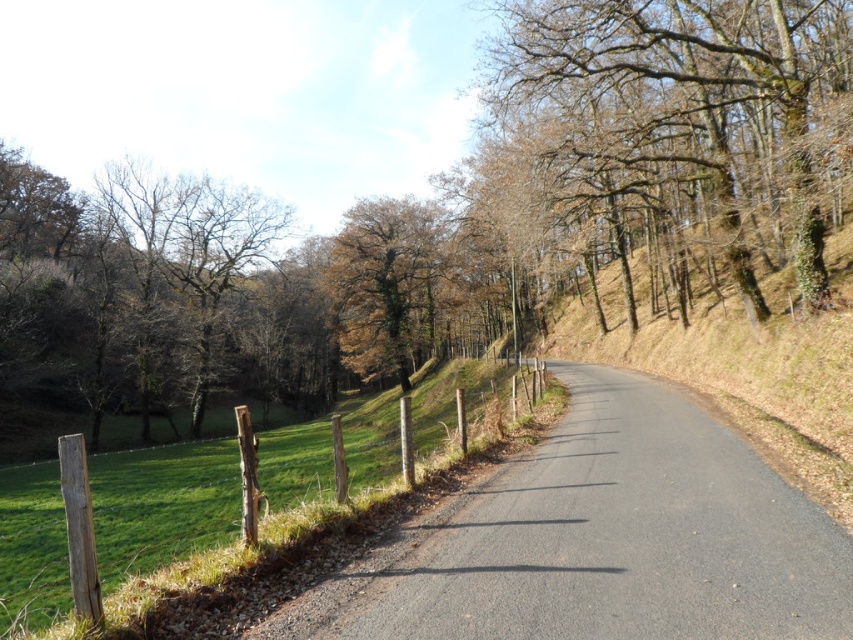
You are driving a car that is 1.8 meters wide. You come across the asphalt road at center and notice the brown leafless tree at upper right. Can your car safely pass through the road without hitting the tree?

The asphalt road at center is narrower than the brown leafless tree at upper right, so the car might not fit safely. Check the road width before proceeding.

You are a hiker standing on the asphalt road at center. You want to walk towards the brown leafless tree at upper right. Which direction should you move to get closer to the tree?

Since the asphalt road at center is closer to the viewer than the brown leafless tree at upper right, you should move forward along the road to get closer to the tree.